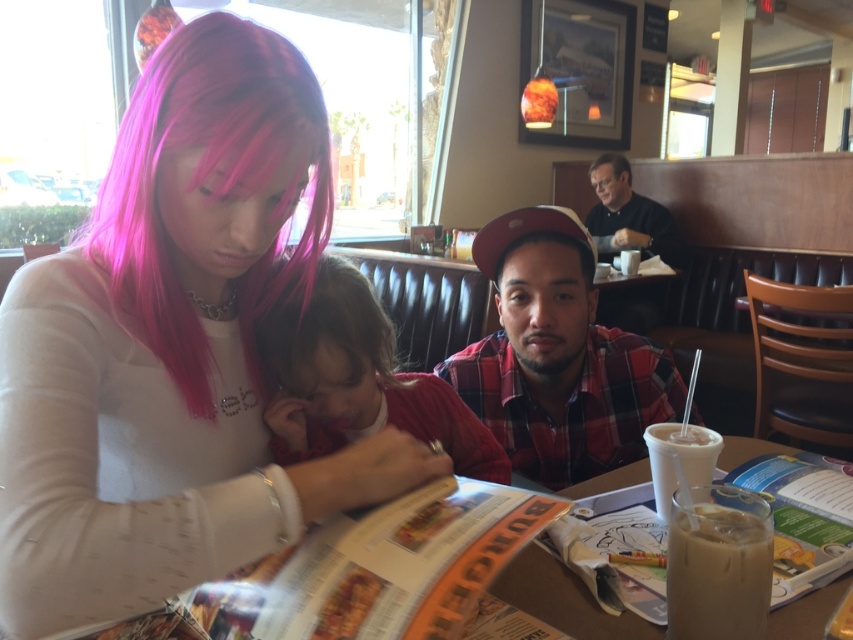
Can you confirm if pink matte wig at upper left is thinner than dark brown hair at upper right?

In fact, pink matte wig at upper left might be wider than dark brown hair at upper right.

Is pink matte wig at upper left to the left of dark brown hair at upper right from the viewer's perspective?

Yes, pink matte wig at upper left is to the left of dark brown hair at upper right.

Does point (199, 65) lie behind point (589, 173)?

No, it is not.

In order to click on pink matte wig at upper left in this screenshot , I will do `click(202, 180)`.

Which is in front, point (412, 540) or point (590, 481)?

Point (412, 540)

Can you confirm if orange glossy magazine at center is taller than translucent plastic menu at center?

Incorrect, orange glossy magazine at center's height is not larger of translucent plastic menu at center's.

Is point (461, 524) positioned after point (538, 570)?

No, (461, 524) is in front of (538, 570).

Identify the location of orange glossy magazine at center. The image size is (853, 640). (383, 568).

Does point (181, 192) lie in front of point (602, 157)?

Yes, it is in front of point (602, 157).

Is pink hair at upper left taller than black matte shirt at upper right?

No.

This screenshot has height=640, width=853. I want to click on pink hair at upper left, so click(171, 348).